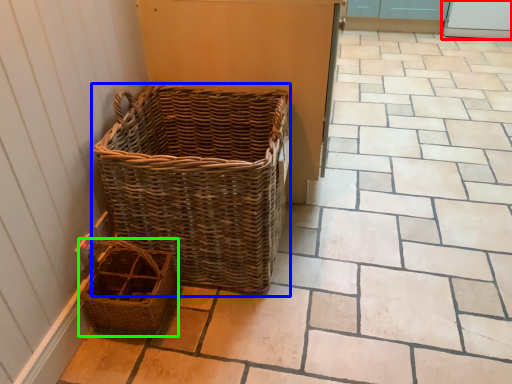
Question: Which object is positioned closest to screen door (highlighted by a red box)? Select from picnic basket (highlighted by a blue box) and picnic basket (highlighted by a green box).

Choices:
 (A) picnic basket
 (B) picnic basket

Answer: (A)